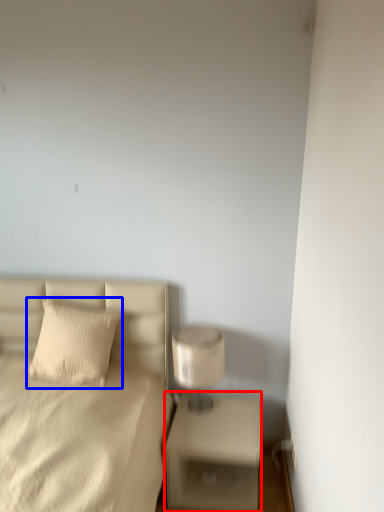
Question: Which object appears closest to the camera in this image, nightstand (highlighted by a red box) or pillow (highlighted by a blue box)?

Choices:
 (A) nightstand
 (B) pillow

Answer: (A)